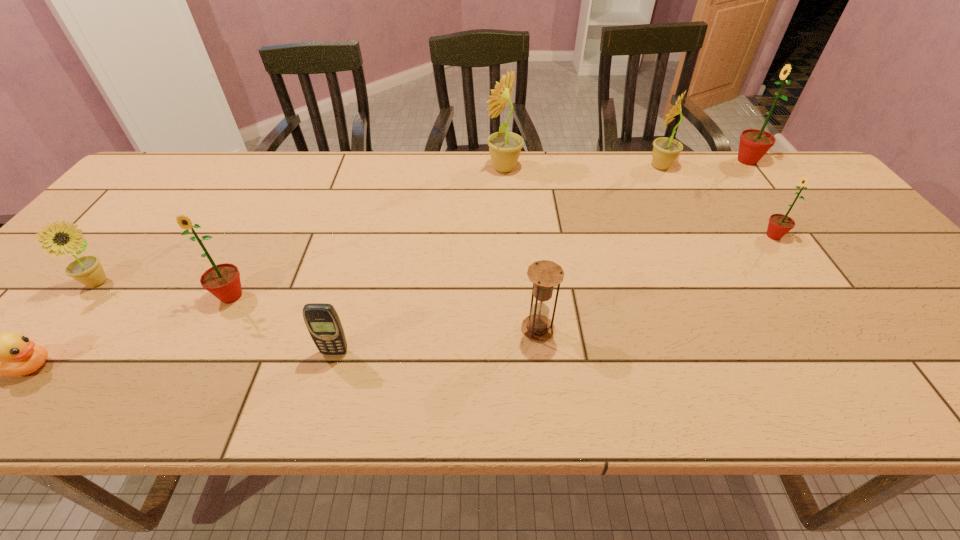
The image size is (960, 540). I want to click on free location located on the face of the rightmost object, so click(643, 161).

Where is `vacant region located on the face of the rightmost object`? vacant region located on the face of the rightmost object is located at coordinates (665, 161).

Find the location of `vacant point located on the face of the fourth sunflower from left to right`. vacant point located on the face of the fourth sunflower from left to right is located at coordinates (534, 166).

At what (x,y) coordinates should I click in order to perform the action: click on blank area located on the face of the fourth sunflower from left to right. Please return your answer as a coordinate pair (x, y). Looking at the image, I should click on (528, 166).

Where is `vacant region located 0.330m on the face of the fourth sunflower from left to right`? This screenshot has height=540, width=960. vacant region located 0.330m on the face of the fourth sunflower from left to right is located at coordinates (x=540, y=166).

This screenshot has width=960, height=540. I want to click on vacant space situated 0.130m on the face of the fifth sunflower from right to left, so click(199, 359).

This screenshot has width=960, height=540. In order to click on free space located 0.170m on the face of the leftmost yellow sunflower in this screenshot , I will do `click(184, 283)`.

Locate an element on the screen. Image resolution: width=960 pixels, height=540 pixels. vacant area situated on the face of the second green sunflower from left to right is located at coordinates (662, 236).

Where is `free point located on the face of the second green sunflower from left to right`? Image resolution: width=960 pixels, height=540 pixels. free point located on the face of the second green sunflower from left to right is located at coordinates (659, 236).

Identify the location of vacant point located 0.390m on the face of the second green sunflower from left to right. This screenshot has width=960, height=540. (612, 236).